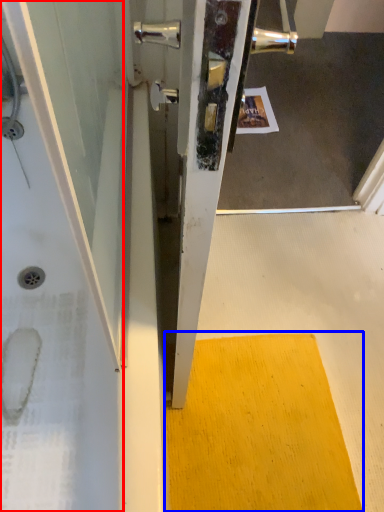
Question: Which of the following is the closest to the observer, bath (highlighted by a red box) or doormat (highlighted by a blue box)?

Choices:
 (A) bath
 (B) doormat

Answer: (A)